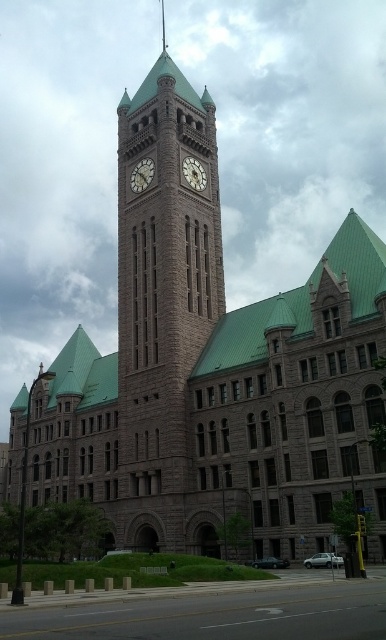
In the scene shown: You are standing in front of the historic building and want to know the distance between you and the brown stone clock tower at center. Can you estimate how far you are from it?

The distance between you and the brown stone clock tower at center is 167.27 feet.